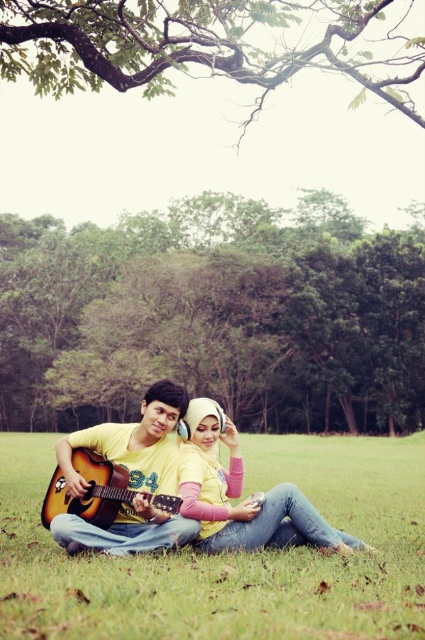
You are planning to set up a picnic blanket in the center of the grassy field where the green grass at center is located. However, there is a green leafy tree at center overhead. Will the tree provide shade over the picnic blanket?

The green leafy tree at center is positioned over the green grass at center, so yes, the tree will provide shade over the picnic blanket placed there.